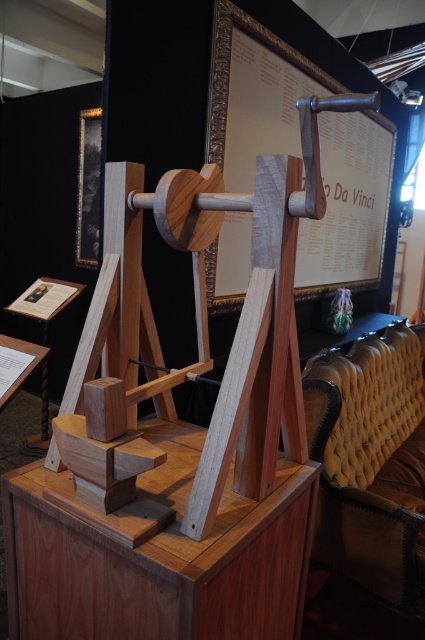
Question: Does wooden framed poster at center appear on the left side of leather tufted armchair at right?

Choices:
 (A) yes
 (B) no

Answer: (A)

Question: Estimate the real-world distances between objects in this image. Which object is farther from the leather tufted armchair at right?

Choices:
 (A) wooden table at center
 (B) wooden framed poster at center

Answer: (B)

Question: Is wooden table at center thinner than leather tufted armchair at right?

Choices:
 (A) yes
 (B) no

Answer: (A)

Question: Which of these objects is positioned farthest from the wooden table at center?

Choices:
 (A) leather tufted armchair at right
 (B) wooden framed poster at center

Answer: (B)

Question: Which object appears farthest from the camera in this image?

Choices:
 (A) wooden table at center
 (B) leather tufted armchair at right

Answer: (B)

Question: Can you confirm if wooden table at center is thinner than leather tufted armchair at right?

Choices:
 (A) no
 (B) yes

Answer: (B)